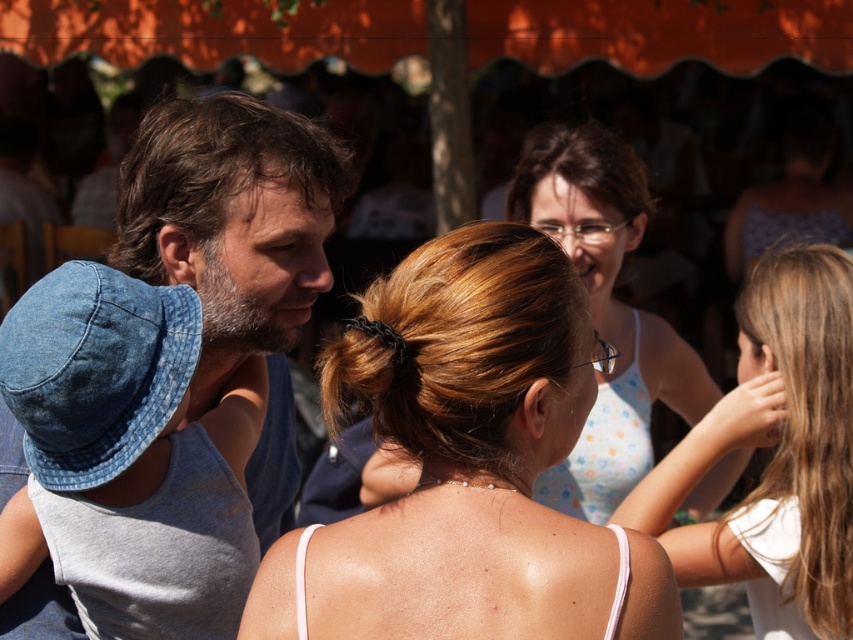
You are a photographer trying to capture a candid shot of the blonde hair at center and the denim hat at left. Which subject should you focus on first to ensure both are in frame?

The blonde hair at center should be focused on first since it is closer to the viewer than the denim hat at left, allowing the photographer to adjust the frame to include both subjects.